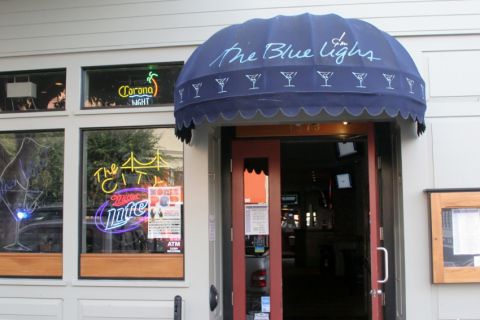
You are a GUI agent. You are given a task and a screenshot of the screen. Output one action in this format:
    pyautogui.click(x=<x>, y=<y>)
    Task: Click on the window
    
    Given the screenshot: What is the action you would take?
    pyautogui.click(x=139, y=181)